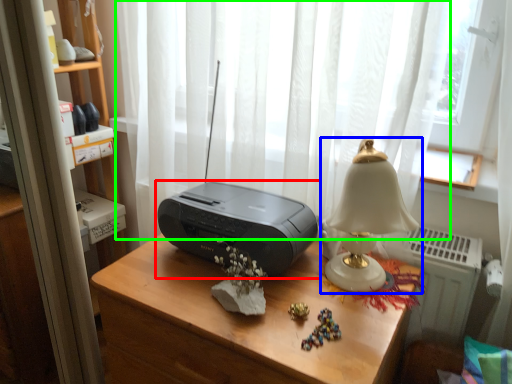
Question: Which object is positioned farthest from printer (highlighted by a red box)? Select from lamp (highlighted by a blue box) and curtain (highlighted by a green box).

Choices:
 (A) lamp
 (B) curtain

Answer: (B)